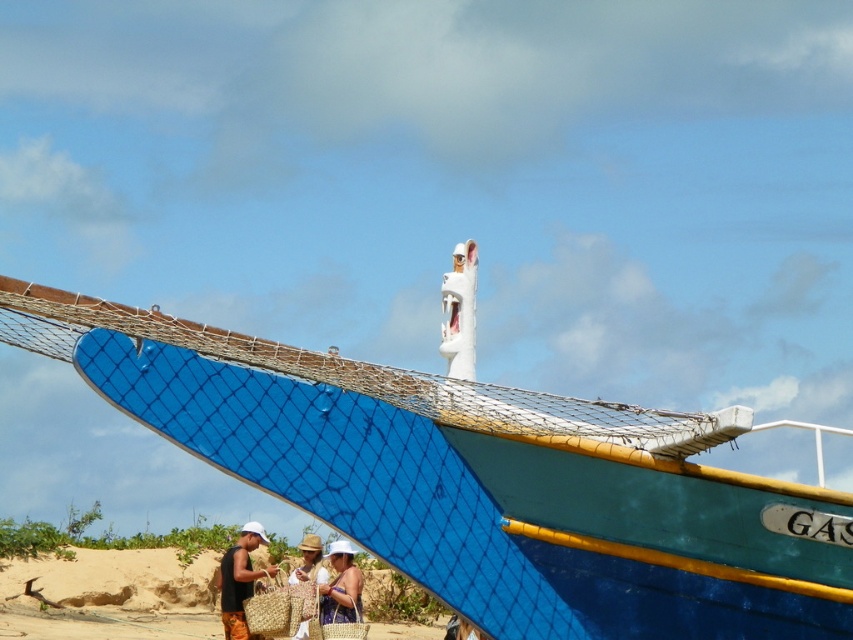
Question: Does black woven bag at lower left have a larger size compared to beige woven hat at lower center?

Choices:
 (A) no
 (B) yes

Answer: (B)

Question: Estimate the real-world distances between objects in this image. Which object is farther from the blue painted wood boat at center?

Choices:
 (A) black woven bag at lower left
 (B) beige woven hat at center
 (C) beige woven baskets at lower center

Answer: (C)

Question: Estimate the real-world distances between objects in this image. Which object is closer to the beige woven hat at center?

Choices:
 (A) black woven bag at lower left
 (B) blue painted wood boat at center
 (C) beige woven baskets at lower center
 (D) beige woven hat at lower center

Answer: (D)

Question: Can you confirm if blue painted wood boat at center is positioned above beige woven hat at center?

Choices:
 (A) no
 (B) yes

Answer: (B)

Question: Which of the following is the farthest from the observer?

Choices:
 (A) (317, 572)
 (B) (190, 406)
 (C) (187, 636)
 (D) (337, 554)

Answer: (C)

Question: Does beige woven baskets at lower center have a greater width compared to beige woven hat at center?

Choices:
 (A) yes
 (B) no

Answer: (A)